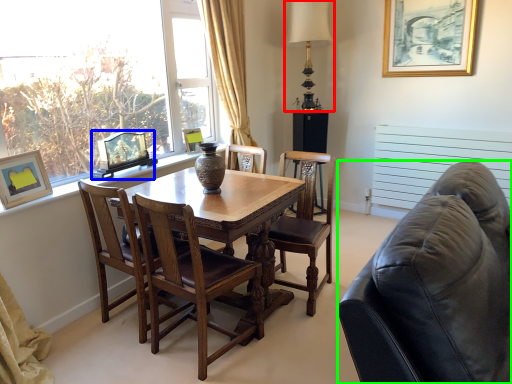
Question: Which is farther away from table lamp (highlighted by a red box)? picture frame (highlighted by a blue box) or studio couch (highlighted by a green box)?

Choices:
 (A) picture frame
 (B) studio couch

Answer: (B)